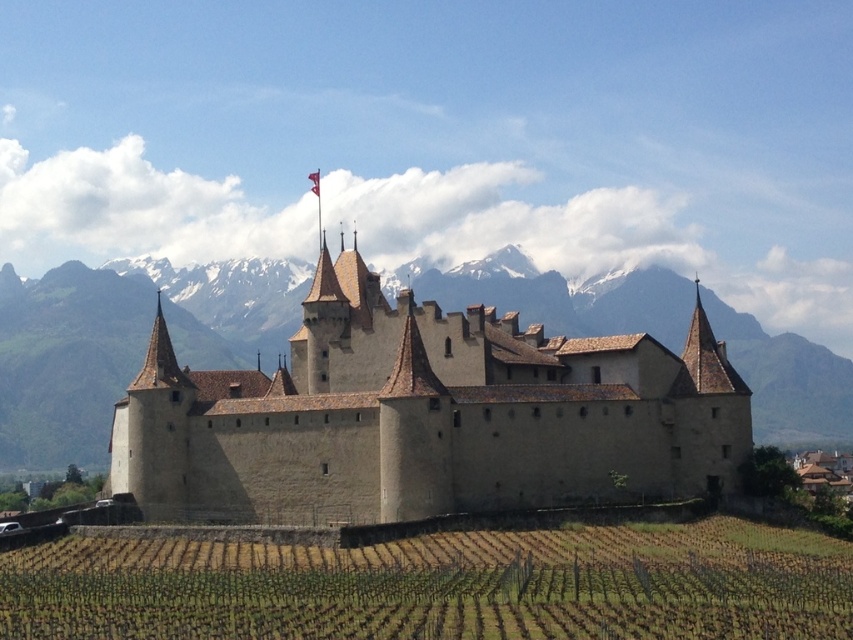
Question: Observing the image, what is the correct spatial positioning of beige stone castle at center in reference to green grassy vineyard at lower center?

Choices:
 (A) above
 (B) below

Answer: (A)

Question: Does beige stone castle at center appear under green grassy vineyard at lower center?

Choices:
 (A) no
 (B) yes

Answer: (A)

Question: Among these objects, which one is nearest to the camera?

Choices:
 (A) beige stone castle at center
 (B) green grassy vineyard at lower center

Answer: (B)

Question: Can you confirm if beige stone castle at center is thinner than green grassy vineyard at lower center?

Choices:
 (A) no
 (B) yes

Answer: (B)

Question: Among these objects, which one is farthest from the camera?

Choices:
 (A) beige stone castle at center
 (B) green grassy vineyard at lower center

Answer: (A)